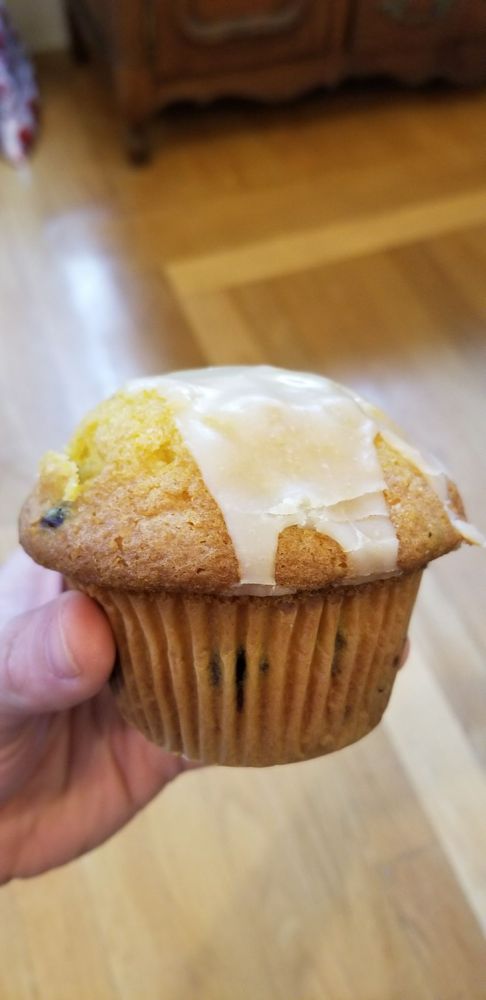
In order to click on cabinet in this screenshot , I will do `click(189, 52)`.